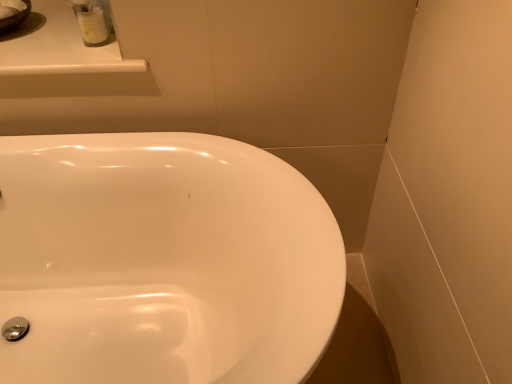
Question: Is white glossy counter top at upper left shorter than white glossy container at upper left?

Choices:
 (A) yes
 (B) no

Answer: (A)

Question: Does white glossy counter top at upper left lie in front of white glossy container at upper left?

Choices:
 (A) no
 (B) yes

Answer: (B)

Question: Is white glossy counter top at upper left taller than white glossy container at upper left?

Choices:
 (A) no
 (B) yes

Answer: (A)

Question: From a real-world perspective, does white glossy counter top at upper left stand above white glossy container at upper left?

Choices:
 (A) no
 (B) yes

Answer: (A)

Question: Is white glossy counter top at upper left next to white glossy container at upper left and touching it?

Choices:
 (A) no
 (B) yes

Answer: (A)

Question: In terms of width, does white glossy counter top at upper left look wider or thinner when compared to white glossy container at upper left?

Choices:
 (A) thin
 (B) wide

Answer: (B)

Question: From the image's perspective, is white glossy counter top at upper left above or below white glossy container at upper left?

Choices:
 (A) below
 (B) above

Answer: (B)

Question: Considering the positions of white glossy counter top at upper left and white glossy container at upper left in the image, is white glossy counter top at upper left taller or shorter than white glossy container at upper left?

Choices:
 (A) tall
 (B) short

Answer: (B)

Question: Is white glossy counter top at upper left inside the boundaries of white glossy container at upper left, or outside?

Choices:
 (A) outside
 (B) inside

Answer: (A)

Question: From a real-world perspective, is white glossy counter top at upper left physically located above or below white glossy sink at center?

Choices:
 (A) below
 (B) above

Answer: (B)

Question: Relative to white glossy sink at center, is white glossy counter top at upper left in front or behind?

Choices:
 (A) behind
 (B) front

Answer: (A)

Question: Is point (48, 66) closer or farther from the camera than point (104, 221)?

Choices:
 (A) closer
 (B) farther

Answer: (A)

Question: In terms of width, does white glossy counter top at upper left look wider or thinner when compared to white glossy sink at center?

Choices:
 (A) thin
 (B) wide

Answer: (A)

Question: Is white glossy sink at center in front of or behind white glossy counter top at upper left in the image?

Choices:
 (A) behind
 (B) front

Answer: (B)

Question: In the image, is white glossy sink at center on the left side or the right side of white glossy counter top at upper left?

Choices:
 (A) left
 (B) right

Answer: (B)